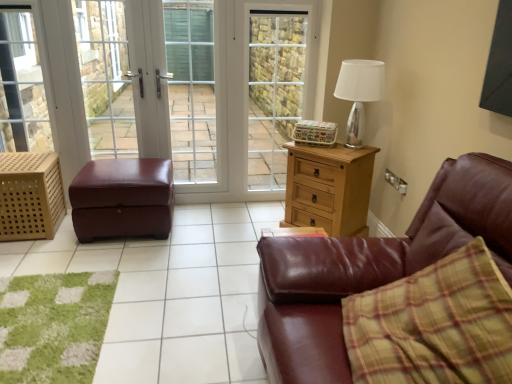
Find the location of a particular element. free location above brown leather ottoman at center (from a real-world perspective) is located at coordinates tap(124, 291).